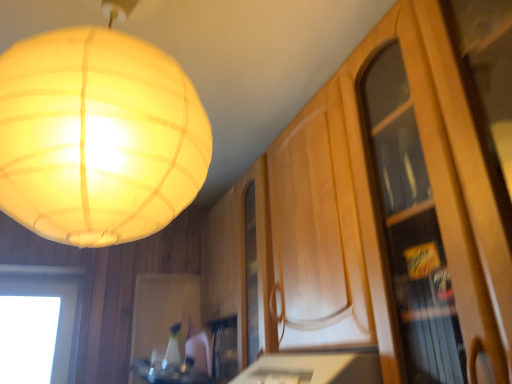
What is the approximate width of matte white lampshade at upper left?

matte white lampshade at upper left is 18.78 inches in width.

The height and width of the screenshot is (384, 512). I want to click on matte white lampshade at upper left, so click(x=98, y=135).

Describe the element at coordinates (98, 135) in the screenshot. I see `matte white lampshade at upper left` at that location.

I want to click on matte white lampshade at upper left, so click(98, 135).